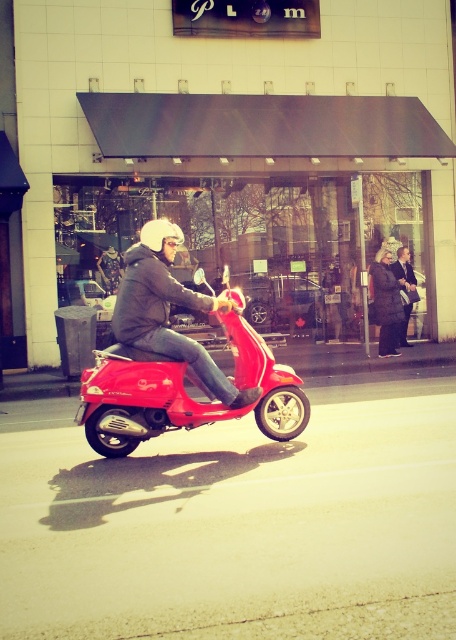
You are a delivery person who needs to attach a small package to your shiny red scooter at center. However, you notice the matte black helmet at upper center is already placed there. Can the package fit alongside the helmet on the scooter?

The shiny red scooter at center has a smaller size compared to matte black helmet at upper center. Since the scooter is smaller and the helmet is already occupying space, there might not be enough room for the package. Check if the package is smaller than the helmet to ensure it can fit.

Looking at this image, you are a customer in a store and see both the dark gray wool coat at center and the leather jacket at center. Which item is easier to reach without moving from your current position?

The dark gray wool coat at center is closer to the viewer than the leather jacket at center, so it is easier to reach without moving.